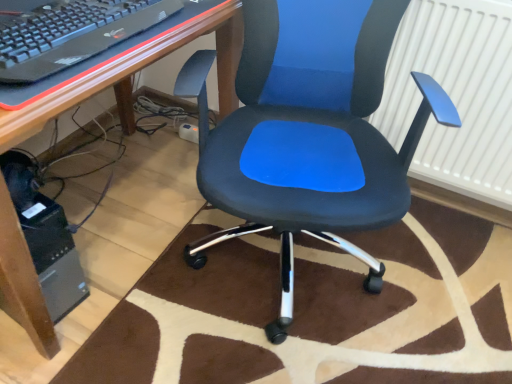
Question: From the image's perspective, is white textured radiator at upper right below black plastic keyboard at upper left?

Choices:
 (A) no
 (B) yes

Answer: (B)

Question: Is white textured radiator at upper right aimed at black plastic keyboard at upper left?

Choices:
 (A) yes
 (B) no

Answer: (B)

Question: Is the position of white textured radiator at upper right more distant than that of black plastic keyboard at upper left?

Choices:
 (A) no
 (B) yes

Answer: (B)

Question: Does white textured radiator at upper right have a greater height compared to black plastic keyboard at upper left?

Choices:
 (A) no
 (B) yes

Answer: (B)

Question: Does white textured radiator at upper right have a lesser height compared to black plastic keyboard at upper left?

Choices:
 (A) no
 (B) yes

Answer: (A)

Question: Looking at the image, does matte black desk at center seem bigger or smaller compared to matte black office chair at center?

Choices:
 (A) big
 (B) small

Answer: (A)

Question: From the image's perspective, is matte black desk at center above or below matte black office chair at center?

Choices:
 (A) above
 (B) below

Answer: (A)

Question: From a real-world perspective, relative to matte black office chair at center, is matte black desk at center vertically above or below?

Choices:
 (A) above
 (B) below

Answer: (B)

Question: Is point (206, 29) closer or farther from the camera than point (423, 87)?

Choices:
 (A) closer
 (B) farther

Answer: (B)

Question: Considering the positions of black plastic keyboard at upper left and matte black desk at center in the image, is black plastic keyboard at upper left wider or thinner than matte black desk at center?

Choices:
 (A) wide
 (B) thin

Answer: (B)

Question: Considering the positions of black plastic keyboard at upper left and matte black desk at center in the image, is black plastic keyboard at upper left taller or shorter than matte black desk at center?

Choices:
 (A) tall
 (B) short

Answer: (B)

Question: Based on their sizes in the image, would you say black plastic keyboard at upper left is bigger or smaller than matte black desk at center?

Choices:
 (A) small
 (B) big

Answer: (A)

Question: Considering the positions of point (221, 18) and point (9, 291), is point (221, 18) closer or farther from the camera than point (9, 291)?

Choices:
 (A) closer
 (B) farther

Answer: (B)

Question: In the image, is matte black desk at center on the left side or the right side of black plastic computer tower at lower left?

Choices:
 (A) left
 (B) right

Answer: (B)

Question: Is matte black desk at center spatially inside black plastic computer tower at lower left, or outside of it?

Choices:
 (A) outside
 (B) inside

Answer: (A)